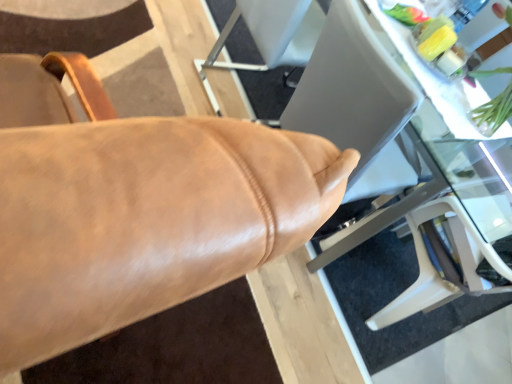
Where is `transparent glass table at center`? The image size is (512, 384). transparent glass table at center is located at coordinates (406, 156).

Based on the photo, is transparent glass table at center bigger or smaller than leather chair at center?

transparent glass table at center is bigger than leather chair at center.

Considering the relative positions of transparent glass table at center and leather chair at center in the image provided, is transparent glass table at center to the left of leather chair at center from the viewer's perspective?

No.

Could you tell me if transparent glass table at center is turned towards leather chair at center?

Yes, transparent glass table at center is facing leather chair at center.

Does transparent glass table at center have a greater width compared to leather chair at center?

Correct, the width of transparent glass table at center exceeds that of leather chair at center.

Is the surface of leather chair at center in direct contact with transparent glass table at center?

There is a gap between leather chair at center and transparent glass table at center.

Is leather chair at center turned away from transparent glass table at center?

No, leather chair at center's orientation is not away from transparent glass table at center.

Based on the photo, who is more distant, leather chair at center or transparent glass table at center?

Positioned behind is transparent glass table at center.

Is point (247, 131) closer or farther from the camera than point (408, 170)?

Clearly, point (247, 131) is closer to the camera than point (408, 170).

Based on the photo, which of these two, leather chair at center or green leafy plant at upper right, is thinner?

Thinner between the two is green leafy plant at upper right.

What's the angular difference between leather chair at center and green leafy plant at upper right's facing directions?

80.5 degrees separate the facing orientations of leather chair at center and green leafy plant at upper right.

Is leather chair at center aimed at green leafy plant at upper right?

No, leather chair at center is not facing towards green leafy plant at upper right.

Is leather chair at center directly adjacent to green leafy plant at upper right?

leather chair at center and green leafy plant at upper right are not in contact.

Does transparent glass table at center appear on the right side of green leafy plant at upper right?

No.

Considering the points (411, 48) and (502, 135), which point is behind, point (411, 48) or point (502, 135)?

Point (411, 48)

From a real-world perspective, is transparent glass table at center physically located above or below green leafy plant at upper right?

From a real-world perspective, transparent glass table at center is physically below green leafy plant at upper right.

Is transparent glass table at center far from green leafy plant at upper right?

Actually, transparent glass table at center and green leafy plant at upper right are a little close together.

Is green leafy plant at upper right surrounding transparent glass table at center?

Definitely not — transparent glass table at center is not inside green leafy plant at upper right.

Considering the sizes of green leafy plant at upper right and transparent glass table at center in the image, is green leafy plant at upper right wider or thinner than transparent glass table at center?

In the image, green leafy plant at upper right appears to be more narrow than transparent glass table at center.

Is green leafy plant at upper right facing away from transparent glass table at center?

Yes.

Consider the image. Can you confirm if green leafy plant at upper right is taller than leather chair at center?

Incorrect, the height of green leafy plant at upper right is not larger of that of leather chair at center.

From a real-world perspective, is green leafy plant at upper right physically above leather chair at center?

Yes, from a real-world perspective, green leafy plant at upper right is over leather chair at center

From the picture: From the image's perspective, is green leafy plant at upper right located beneath leather chair at center?

No, from the image's perspective, green leafy plant at upper right is not beneath leather chair at center.

Image resolution: width=512 pixels, height=384 pixels. Find the location of `chair that is below the transparent glass table at center (from the image's perspective)`. chair that is below the transparent glass table at center (from the image's perspective) is located at coordinates (135, 207).

Locate an element on the screen. table on the right of the leather chair at center is located at coordinates (406, 156).

Based on their spatial positions, is green leafy plant at upper right or leather chair at center further from transparent glass table at center?

The object further to transparent glass table at center is leather chair at center.

Looking at this image, estimate the real-world distances between objects in this image. Which object is further from green leafy plant at upper right, leather chair at center or transparent glass table at center?

leather chair at center lies further to green leafy plant at upper right than the other object.

Which object lies nearer to the anchor point leather chair at center, green leafy plant at upper right or transparent glass table at center?

Among the two, transparent glass table at center is located nearer to leather chair at center.

Which object lies nearer to the anchor point green leafy plant at upper right, transparent glass table at center or leather chair at center?

transparent glass table at center is positioned closer to the anchor green leafy plant at upper right.

When comparing their distances from transparent glass table at center, does leather chair at center or green leafy plant at upper right seem further?

The object further to transparent glass table at center is leather chair at center.

From the image, which object appears to be nearer to leather chair at center, transparent glass table at center or green leafy plant at upper right?

transparent glass table at center is closer to leather chair at center.

At what (x,y) coordinates should I click in order to perform the action: click on table between leather chair at center and green leafy plant at upper right along the z-axis. Please return your answer as a coordinate pair (x, y). This screenshot has width=512, height=384. Looking at the image, I should click on (406, 156).